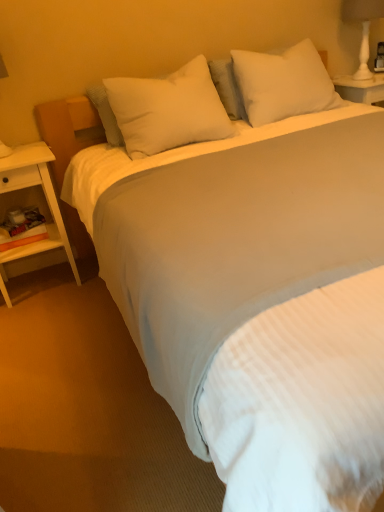
Question: Can you confirm if white wood nightstand at left is bigger than white soft pillow at upper center, the second pillow in the right-to-left sequence?

Choices:
 (A) no
 (B) yes

Answer: (B)

Question: Would you consider white wood nightstand at left to be distant from white soft pillow at upper center, which is the 1th pillow in left-to-right order?

Choices:
 (A) no
 (B) yes

Answer: (A)

Question: Is white wood nightstand at left surrounding white soft pillow at upper center, the second pillow in the right-to-left sequence?

Choices:
 (A) yes
 (B) no

Answer: (B)

Question: From the image's perspective, is white wood nightstand at left located beneath white soft pillow at upper center, the second pillow in the right-to-left sequence?

Choices:
 (A) yes
 (B) no

Answer: (A)

Question: Is white wood nightstand at left oriented towards white soft pillow at upper center, which is the 1th pillow in left-to-right order?

Choices:
 (A) no
 (B) yes

Answer: (A)

Question: Considering the positions of point (6, 156) and point (193, 70), is point (6, 156) closer or farther from the camera than point (193, 70)?

Choices:
 (A) farther
 (B) closer

Answer: (B)

Question: From the image's perspective, is white wood nightstand at left positioned above or below white soft pillow at upper center, which is the 1th pillow in left-to-right order?

Choices:
 (A) below
 (B) above

Answer: (A)

Question: From a real-world perspective, is white wood nightstand at left physically located above or below white soft pillow at upper center, the second pillow in the right-to-left sequence?

Choices:
 (A) above
 (B) below

Answer: (B)

Question: Is white wood nightstand at left inside the boundaries of white soft pillow at upper center, which is the 1th pillow in left-to-right order, or outside?

Choices:
 (A) inside
 (B) outside

Answer: (B)

Question: Would you say white soft pillow at upper center, the second pillow in the right-to-left sequence, is to the left or to the right of white wood nightstand at left in the picture?

Choices:
 (A) left
 (B) right

Answer: (B)

Question: From the image's perspective, is white soft pillow at upper center, the second pillow in the right-to-left sequence, above or below white wood nightstand at left?

Choices:
 (A) below
 (B) above

Answer: (B)

Question: Considering the positions of point (177, 129) and point (46, 168), is point (177, 129) closer or farther from the camera than point (46, 168)?

Choices:
 (A) closer
 (B) farther

Answer: (A)

Question: Considering their positions, is white soft pillow at upper center, which is the 1th pillow in left-to-right order, located in front of or behind white wood nightstand at left?

Choices:
 (A) front
 (B) behind

Answer: (A)

Question: From their relative heights in the image, would you say white soft pillow at upper center, which ranks as the 2th pillow in left-to-right order, is taller or shorter than white ceramic lamp at upper right?

Choices:
 (A) tall
 (B) short

Answer: (B)

Question: Considering the positions of white soft pillow at upper center, which ranks as the 2th pillow in left-to-right order, and white ceramic lamp at upper right in the image, is white soft pillow at upper center, which ranks as the 2th pillow in left-to-right order, wider or thinner than white ceramic lamp at upper right?

Choices:
 (A) wide
 (B) thin

Answer: (A)